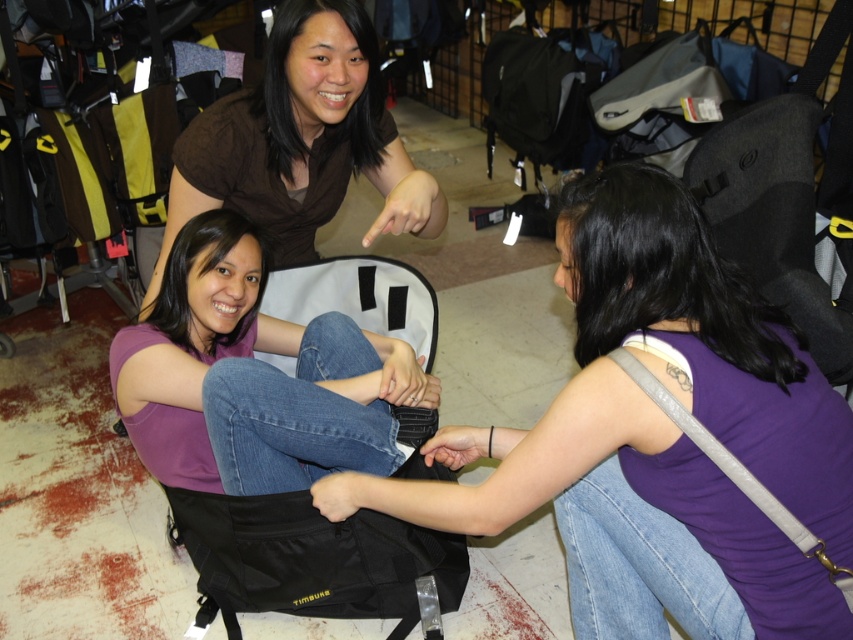
You are standing at the origin point in the image. Where is the purple matte tank top at center located in terms of coordinates?

The purple matte tank top at center is located at coordinates point (x=659, y=436).

You are a store employee who wants to direct a customer to the exit, which is to the right of the purple matte tank top at center. Which direction should you point relative to the matte brown shirt at upper center?

The purple matte tank top at center is on the right side of the matte brown shirt at upper center. Since the exit is to the right of the purple matte tank top at center, you should point further to the right beyond the purple matte tank top at center from the perspective of the matte brown shirt at upper center.